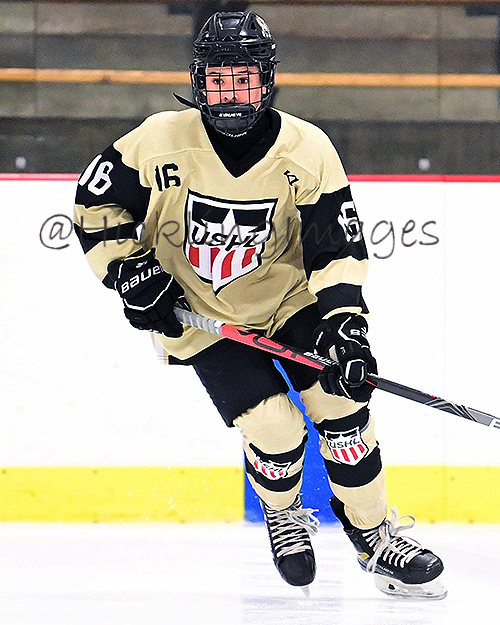
At what (x,y) coordinates should I click in order to perform the action: click on blue stripe on wall behind skater. Please return your answer as a coordinate pair (x, y). Looking at the image, I should click on (312, 480).